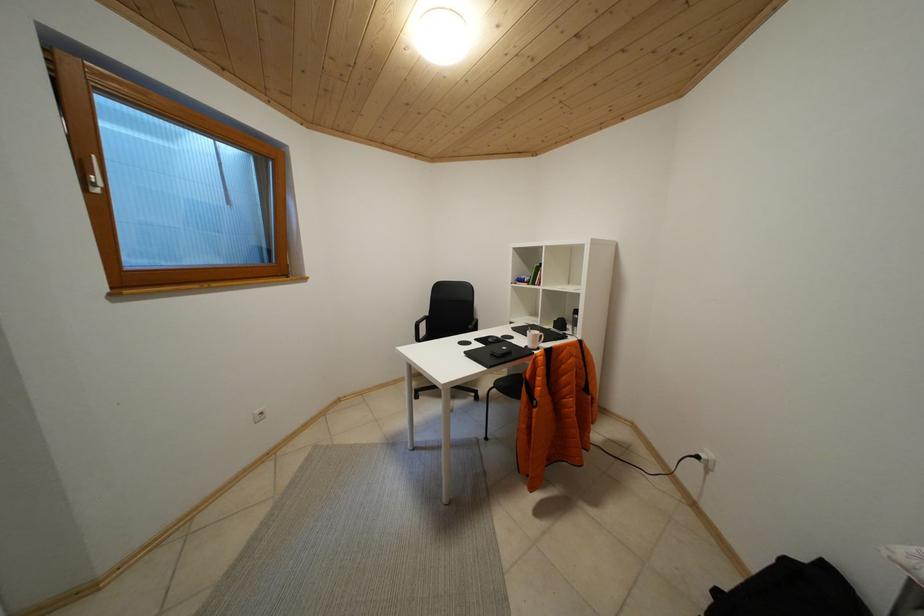
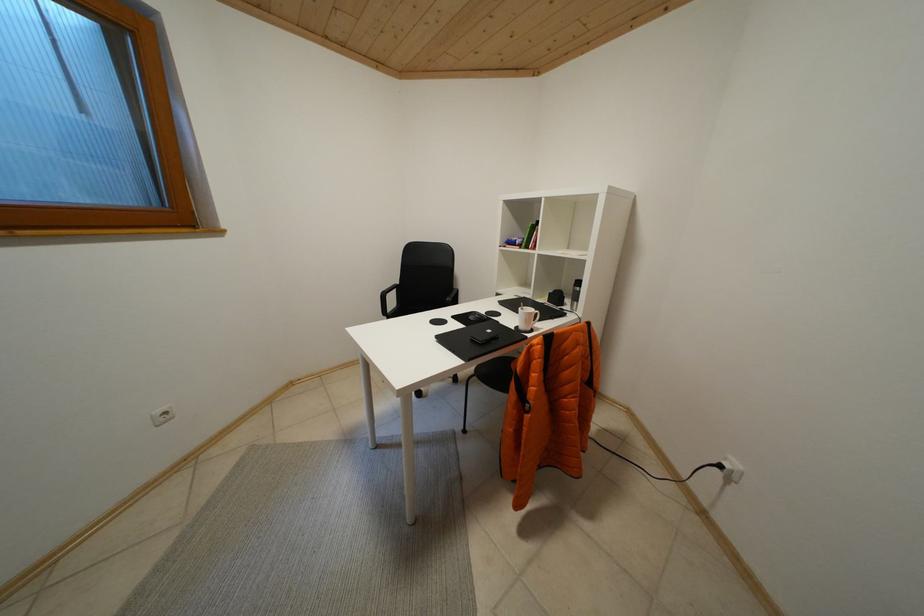
Question: The images are taken continuously from a first-person perspective. In which direction is your viewpoint rotating?

Choices:
 (A) Left
 (B) Right
 (C) Up
 (D) Down

Answer: (D)